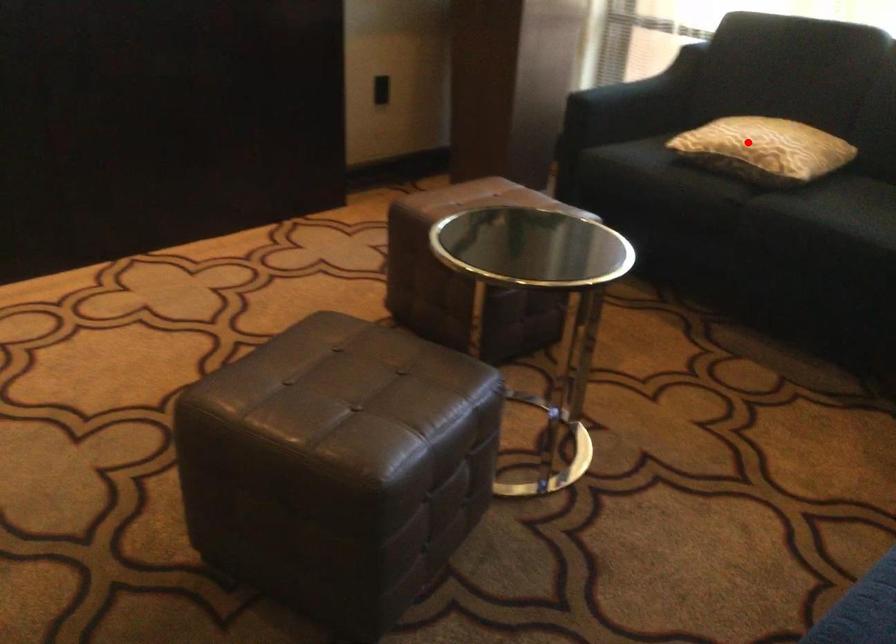
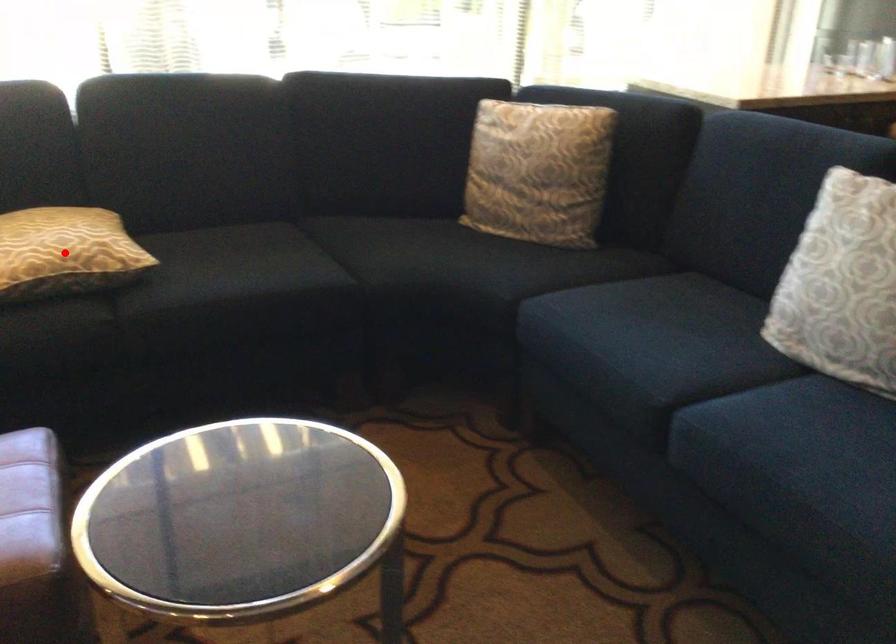
I am providing you with two images of the same scene from different viewpoints. A red point is marked on the first image and another point is marked on the second image. Do the highlighted points in image1 and image2 indicate the same real-world spot?

Yes